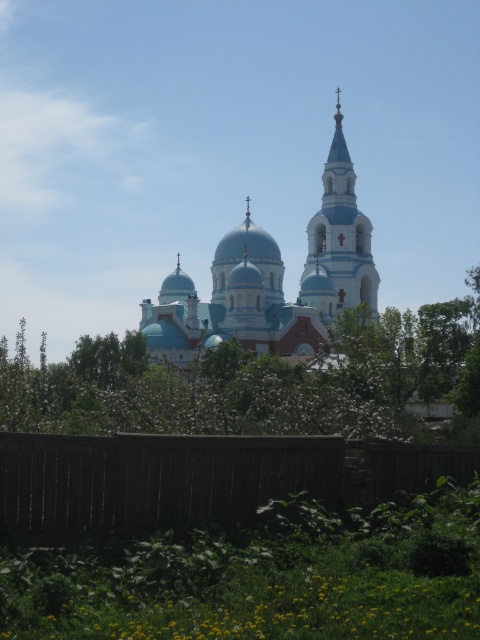
Does point (237, 372) come closer to viewer compared to point (356, 220)?

Yes, it is.

Who is lower down, green leafy tree at center or smooth blue tower at center?

green leafy tree at center is lower down.

Is point (336, 420) positioned before point (312, 218)?

Yes, it is.

Where is `green leafy tree at center`? This screenshot has width=480, height=640. green leafy tree at center is located at coordinates (262, 381).

Does brown wooden fence at lower center appear on the left side of smooth blue tower at center?

Correct, you'll find brown wooden fence at lower center to the left of smooth blue tower at center.

Is brown wooden fence at lower center bigger than smooth blue tower at center?

No.

Image resolution: width=480 pixels, height=640 pixels. Find the location of `brown wooden fence at lower center`. brown wooden fence at lower center is located at coordinates (157, 480).

Does green leafy tree at center have a lesser width compared to blue painted brick church at center?

No.

Is the position of green leafy tree at center less distant than that of blue painted brick church at center?

Yes, it is.

Where is `green leafy tree at center`? The height and width of the screenshot is (640, 480). green leafy tree at center is located at coordinates (262, 381).